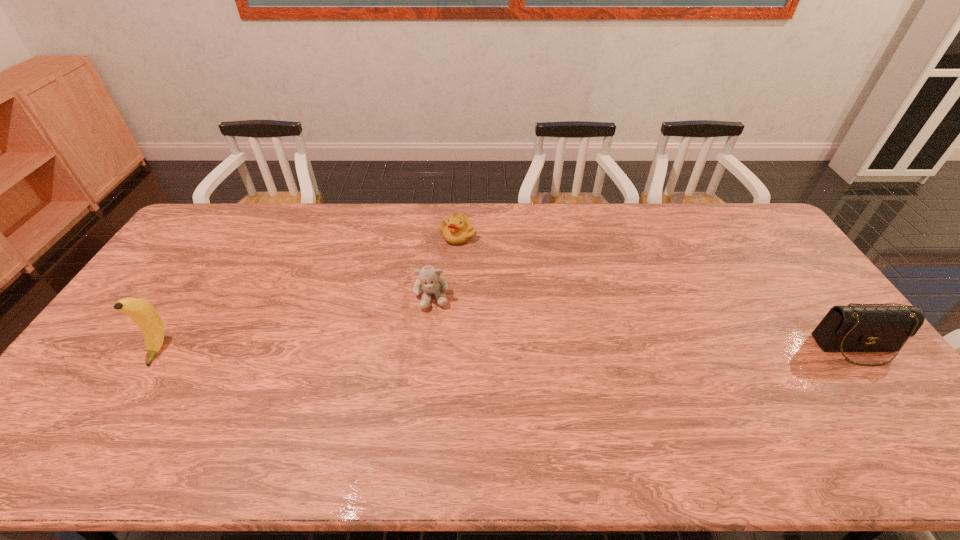
Locate an element on the screen. This screenshot has height=540, width=960. vacant point located between the third nearest object and the clutch bag is located at coordinates (644, 322).

Identify the location of free spot between the tallest object and the rightmost object. Image resolution: width=960 pixels, height=540 pixels. (508, 348).

Identify the location of object that stands as the third closest to the farthest object. (871, 328).

Locate which object ranks third in proximity to the leftmost object. Please provide its 2D coordinates. Your answer should be formatted as a tuple, i.e. [(x, y)], where the tuple contains the x and y coordinates of a point satisfying the conditions above.

[(871, 328)]

At what (x,y) coordinates should I click in order to perform the action: click on free space that satisfies the following two spatial constraints: 1. on the back side of the second farthest object; 2. on the left side of the duckling. Please return your answer as a coordinate pair (x, y). This screenshot has height=540, width=960. Looking at the image, I should click on (439, 235).